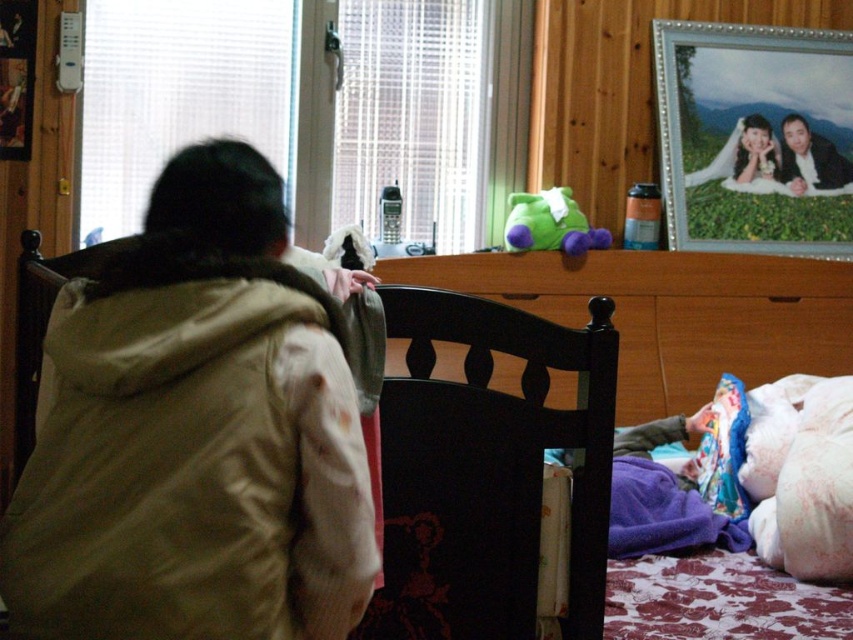
Is point (630, 260) behind point (701, 100)?

No, (630, 260) is closer to viewer.

Can you confirm if dark wood dresser at center is shorter than metallic silver picture frame at upper right?

Yes.

Find the location of a particular element. Image resolution: width=853 pixels, height=640 pixels. dark wood dresser at center is located at coordinates (670, 314).

Where is `beige fur-lined jacket at upper left`? This screenshot has height=640, width=853. beige fur-lined jacket at upper left is located at coordinates (195, 435).

Is beige fur-lined jacket at upper left taller than black wood bed at center?

Indeed, beige fur-lined jacket at upper left has a greater height compared to black wood bed at center.

Between point (83, 602) and point (47, 268), which one is positioned behind?

The point (47, 268) is more distant.

Locate an element on the screen. beige fur-lined jacket at upper left is located at coordinates (x=195, y=435).

Between green plush toy at upper center and smooth black hair at upper right, which one is positioned lower?

green plush toy at upper center

Which is in front, point (532, 234) or point (830, 156)?

Point (532, 234) is more forward.

Between point (526, 244) and point (833, 179), which one is positioned behind?

Positioned behind is point (833, 179).

Find the location of `green plush toy at upper center`. green plush toy at upper center is located at coordinates (550, 224).